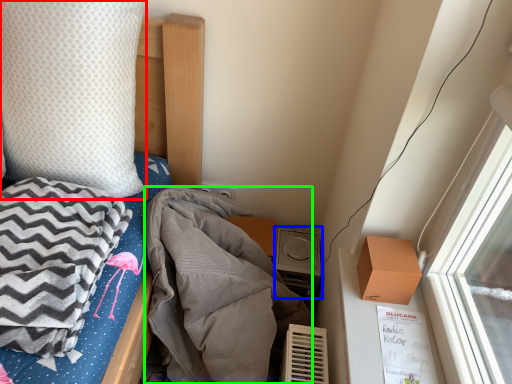
Question: Which object is the closest to the pillow (highlighted by a red box)? Choose among these: stereo (highlighted by a blue box) or blanket (highlighted by a green box).

Choices:
 (A) stereo
 (B) blanket

Answer: (B)